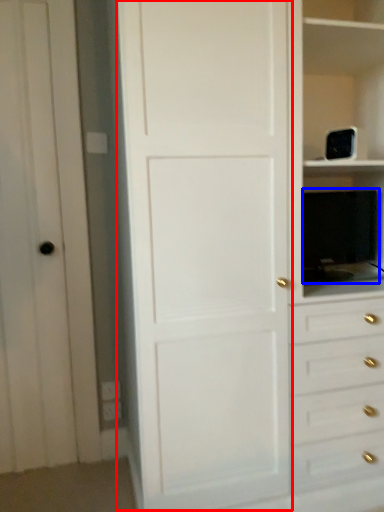
Question: Which of the following is the farthest to the observer, door (highlighted by a red box) or appliance (highlighted by a blue box)?

Choices:
 (A) door
 (B) appliance

Answer: (B)